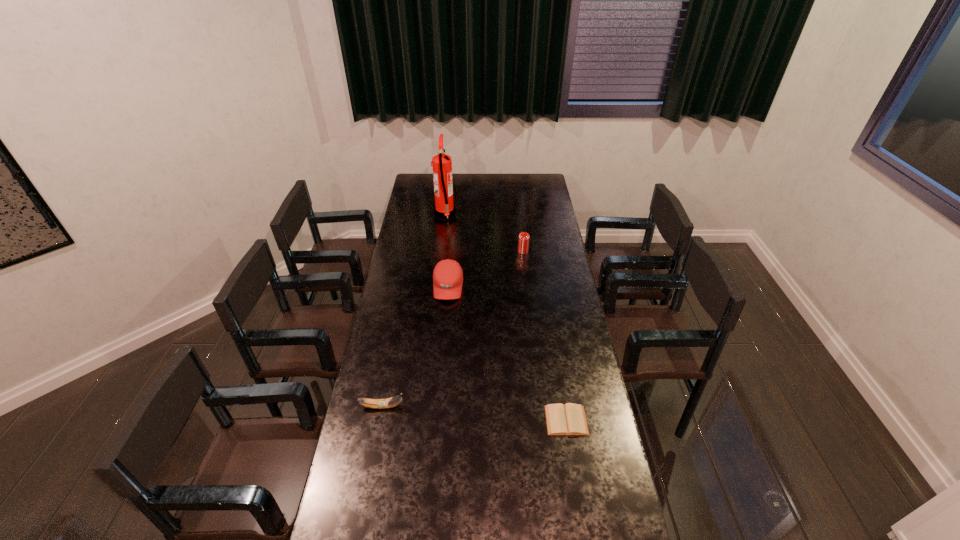
You are a GUI agent. You are given a task and a screenshot of the screen. Output one action in this format:
    pyautogui.click(x=<x>, y=<y>)
    Task: Click on the vacant space located 0.070m on the back of the shortest object
    The width and height of the screenshot is (960, 540).
    Given the screenshot: What is the action you would take?
    (x=562, y=389)

Image resolution: width=960 pixels, height=540 pixels. In order to click on object that is at the left edge in this screenshot , I will do `click(391, 402)`.

This screenshot has width=960, height=540. I want to click on object that is positioned at the right edge, so click(569, 419).

In the image, there is a desktop. Where is `vacant space at the far edge`? The height and width of the screenshot is (540, 960). vacant space at the far edge is located at coordinates (472, 190).

In the image, there is a desktop. At what (x,y) coordinates should I click in order to perform the action: click on vacant region at the left edge. Please return your answer as a coordinate pair (x, y). The height and width of the screenshot is (540, 960). Looking at the image, I should click on 408,204.

You are a GUI agent. You are given a task and a screenshot of the screen. Output one action in this format:
    pyautogui.click(x=<x>, y=<y>)
    Task: Click on the vacant space at the right edge of the desktop
    
    Given the screenshot: What is the action you would take?
    pyautogui.click(x=542, y=253)

Image resolution: width=960 pixels, height=540 pixels. In the image, there is a desktop. In order to click on free space at the far left corner in this screenshot , I will do `click(417, 174)`.

Identify the location of empty space between the diary and the third nearest object. (507, 353).

At what (x,y) coordinates should I click in order to perform the action: click on vacant area between the leftmost object and the third farthest object. Please return your answer as a coordinate pair (x, y). The width and height of the screenshot is (960, 540). Looking at the image, I should click on (415, 347).

Where is `empty space that is in between the second farthest object and the third nearest object`? The width and height of the screenshot is (960, 540). empty space that is in between the second farthest object and the third nearest object is located at coordinates (486, 269).